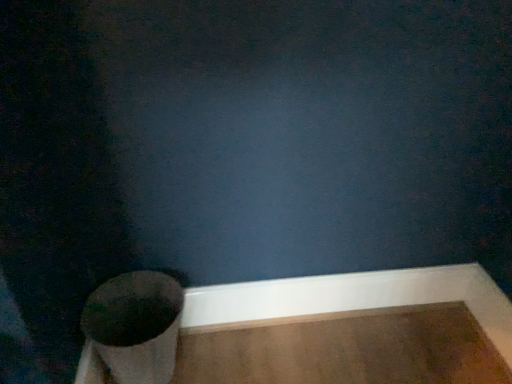
Question: Does white smooth baseboard at lower right come behind matte black toilet at lower left?

Choices:
 (A) no
 (B) yes

Answer: (B)

Question: Can you confirm if white smooth baseboard at lower right is shorter than matte black toilet at lower left?

Choices:
 (A) no
 (B) yes

Answer: (B)

Question: Is white smooth baseboard at lower right to the right of matte black toilet at lower left from the viewer's perspective?

Choices:
 (A) yes
 (B) no

Answer: (A)

Question: Does white smooth baseboard at lower right turn towards matte black toilet at lower left?

Choices:
 (A) no
 (B) yes

Answer: (B)

Question: From a real-world perspective, is white smooth baseboard at lower right beneath matte black toilet at lower left?

Choices:
 (A) yes
 (B) no

Answer: (A)

Question: Is white smooth baseboard at lower right smaller than matte black toilet at lower left?

Choices:
 (A) no
 (B) yes

Answer: (B)

Question: From the image's perspective, does matte black toilet at lower left appear lower than white smooth baseboard at lower right?

Choices:
 (A) no
 (B) yes

Answer: (B)

Question: From a real-world perspective, does matte black toilet at lower left stand above white smooth baseboard at lower right?

Choices:
 (A) yes
 (B) no

Answer: (A)

Question: Is matte black toilet at lower left behind white smooth baseboard at lower right?

Choices:
 (A) yes
 (B) no

Answer: (B)

Question: Is matte black toilet at lower left located outside white smooth baseboard at lower right?

Choices:
 (A) no
 (B) yes

Answer: (B)

Question: Does matte black toilet at lower left have a larger size compared to white smooth baseboard at lower right?

Choices:
 (A) yes
 (B) no

Answer: (A)

Question: Is matte black toilet at lower left at the right side of white smooth baseboard at lower right?

Choices:
 (A) yes
 (B) no

Answer: (B)

Question: From their relative heights in the image, would you say white smooth baseboard at lower right is taller or shorter than matte black toilet at lower left?

Choices:
 (A) tall
 (B) short

Answer: (B)